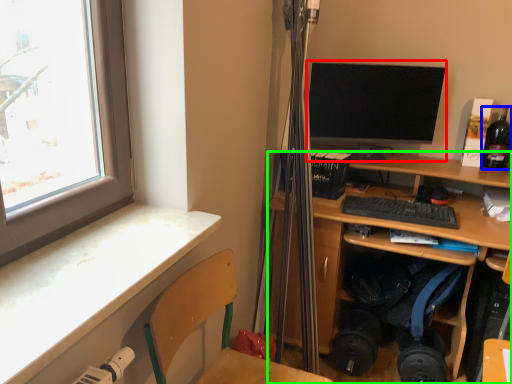
Question: Based on their relative distances, which object is nearer to computer monitor (highlighted by a red box)? Choose from bottle (highlighted by a blue box) and desk (highlighted by a green box).

Choices:
 (A) bottle
 (B) desk

Answer: (B)